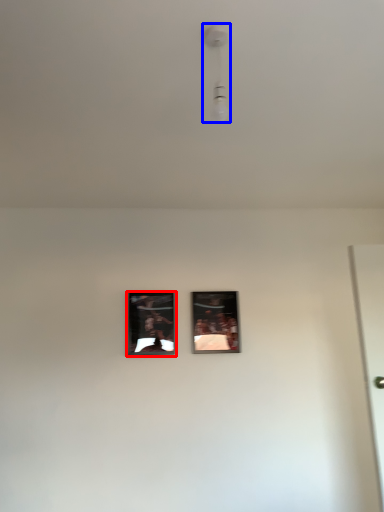
Question: Which of the following is the farthest to the observer, picture frame (highlighted by a red box) or light fixture (highlighted by a blue box)?

Choices:
 (A) picture frame
 (B) light fixture

Answer: (A)